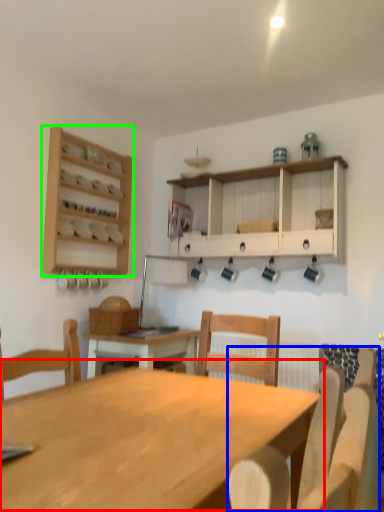
Question: Considering the real-world distances, which object is closest to table (highlighted by a red box)? chair (highlighted by a blue box) or shelf (highlighted by a green box).

Choices:
 (A) chair
 (B) shelf

Answer: (A)